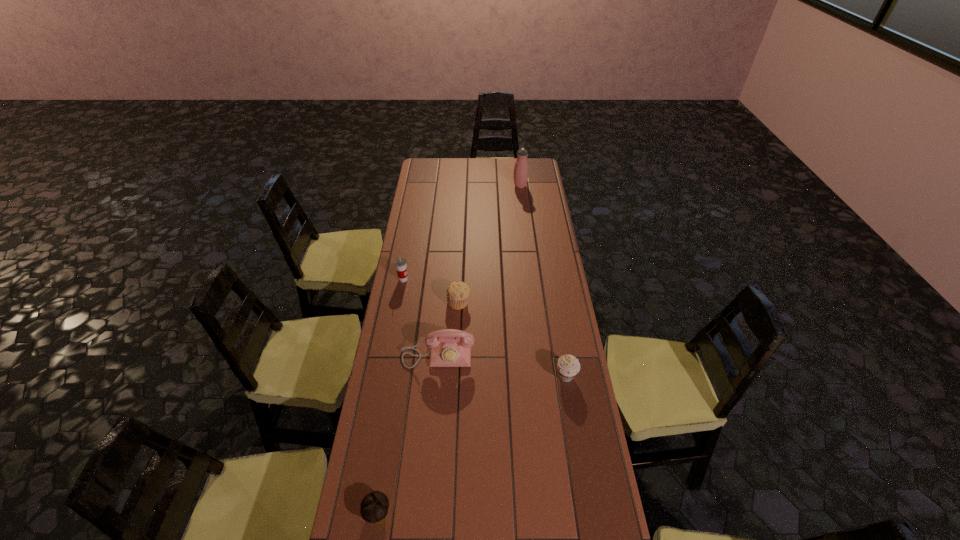
The width and height of the screenshot is (960, 540). I want to click on the fifth object from left to right, so click(521, 169).

Where is `the tallest object`? the tallest object is located at coordinates (521, 169).

This screenshot has height=540, width=960. What are the coordinates of `cup` in the screenshot? It's located at (400, 263).

The width and height of the screenshot is (960, 540). In order to click on telephone in this screenshot , I will do `click(449, 347)`.

At what (x,y) coordinates should I click in order to perform the action: click on the rightmost muffin. Please return your answer as a coordinate pair (x, y). The width and height of the screenshot is (960, 540). Looking at the image, I should click on (568, 366).

The height and width of the screenshot is (540, 960). I want to click on the second nearest muffin, so click(x=568, y=366).

The height and width of the screenshot is (540, 960). What are the coordinates of `the farthest muffin` in the screenshot? It's located at (458, 292).

Where is `the fifth tallest object`? This screenshot has width=960, height=540. the fifth tallest object is located at coordinates (458, 292).

Identify the location of the nearest object. This screenshot has width=960, height=540. (374, 507).

The height and width of the screenshot is (540, 960). Find the location of `the leftmost muffin`. the leftmost muffin is located at coordinates (374, 507).